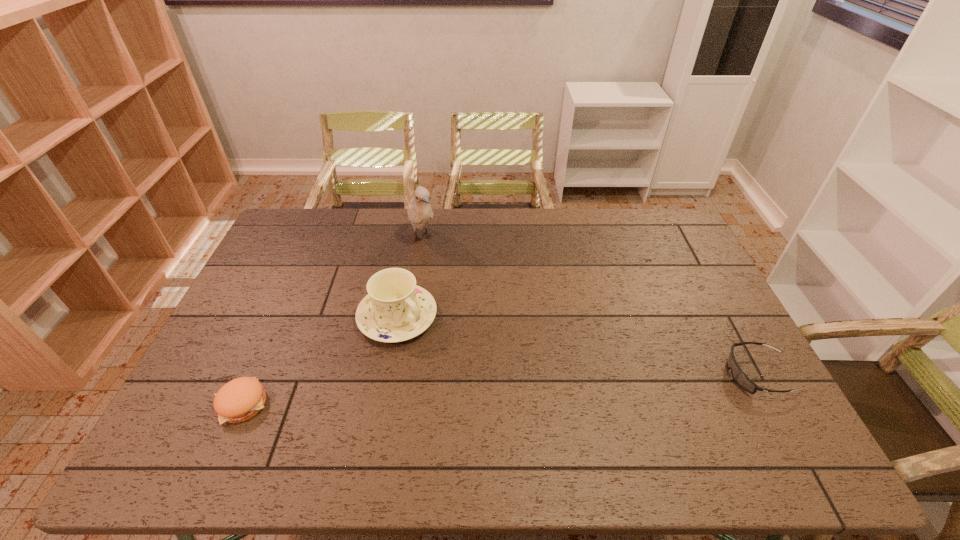
This screenshot has height=540, width=960. Find the location of `vacant space located 0.230m at the beak of the farthest object`. vacant space located 0.230m at the beak of the farthest object is located at coordinates (452, 295).

Find the location of `vacant space located at the beak of the farthest object`. vacant space located at the beak of the farthest object is located at coordinates (439, 274).

Where is `vacant space located 0.050m at the beak of the farthest object`? The width and height of the screenshot is (960, 540). vacant space located 0.050m at the beak of the farthest object is located at coordinates (431, 262).

Image resolution: width=960 pixels, height=540 pixels. I want to click on free space located 0.290m on the handle side of the third nearest object, so click(x=498, y=399).

What are the coordinates of `blank space located on the handle side of the third nearest object` in the screenshot? It's located at (490, 392).

The height and width of the screenshot is (540, 960). What are the coordinates of `free space located 0.200m on the handle side of the third nearest object` in the screenshot? It's located at (473, 378).

At what (x,y) coordinates should I click in order to perform the action: click on object positioned at the far edge. Please return your answer as a coordinate pair (x, y). Looking at the image, I should click on (420, 213).

This screenshot has width=960, height=540. Identify the location of patty located in the near edge section of the desktop. (240, 399).

Where is `goggles that is at the near edge`? This screenshot has height=540, width=960. goggles that is at the near edge is located at coordinates (741, 379).

Where is `object that is at the left edge`? object that is at the left edge is located at coordinates (240, 399).